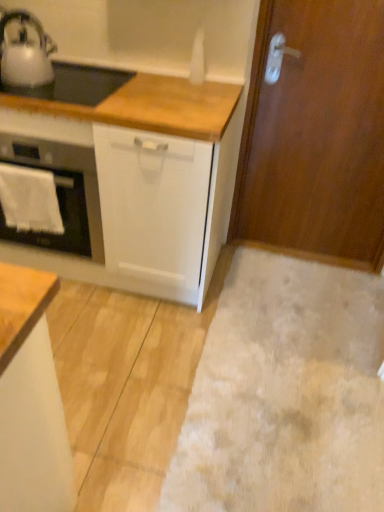
Question: Looking at their shapes, would you say white matte cabinet at lower left is wider or thinner than wooden door at right?

Choices:
 (A) thin
 (B) wide

Answer: (B)

Question: Is white matte cabinet at lower left situated inside wooden door at right or outside?

Choices:
 (A) outside
 (B) inside

Answer: (A)

Question: Which of these objects is positioned closest to the wooden door at right?

Choices:
 (A) white glossy oven at left
 (B) metallic silver kettle at upper left
 (C) beige carpet at lower right
 (D) white towel at left
 (E) white matte cabinet at lower left

Answer: (C)

Question: Estimate the real-world distances between objects in this image. Which object is farther from the white matte cabinet at lower left?

Choices:
 (A) wooden door at right
 (B) white towel at left
 (C) white glossy oven at left
 (D) metallic silver kettle at upper left
 (E) beige carpet at lower right

Answer: (A)